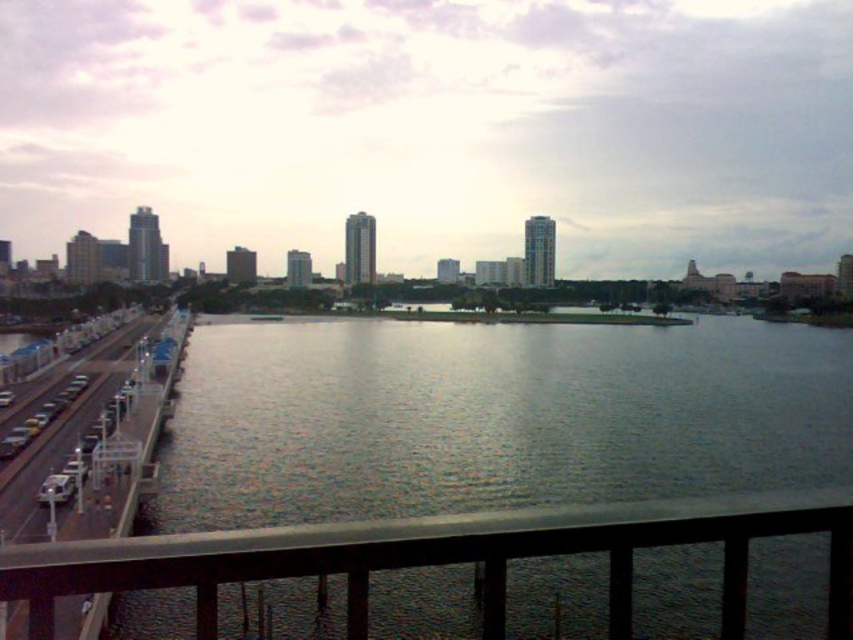
Between gray smooth water at center and transparent glass railing at lower center, which one is positioned lower?

transparent glass railing at lower center is lower down.

The image size is (853, 640). In order to click on gray smooth water at center in this screenshot , I will do `click(492, 417)`.

Identify the location of gray smooth water at center. (492, 417).